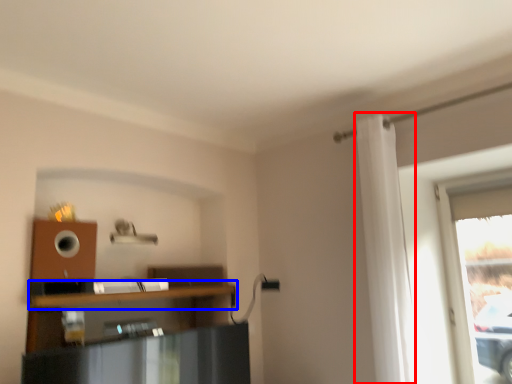
Question: Among these objects, which one is farthest to the camera, curtain (highlighted by a red box) or shelf (highlighted by a blue box)?

Choices:
 (A) curtain
 (B) shelf

Answer: (A)